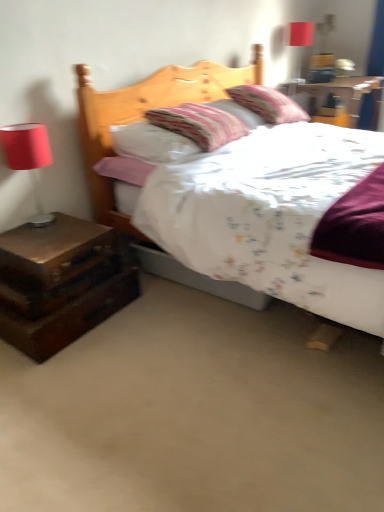
The width and height of the screenshot is (384, 512). I want to click on free space in front of matte red lampshade at left, so click(34, 242).